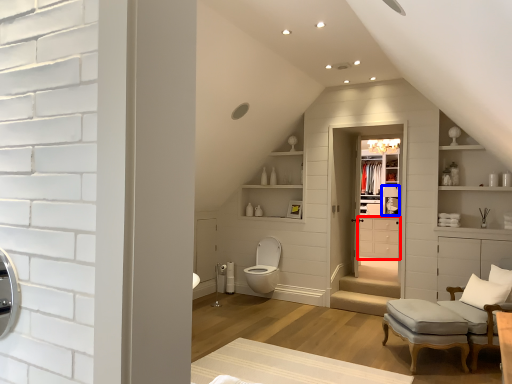
Question: Which object appears farthest to the camera in this image, cabinetry (highlighted by a red box) or lamp (highlighted by a blue box)?

Choices:
 (A) cabinetry
 (B) lamp

Answer: (B)